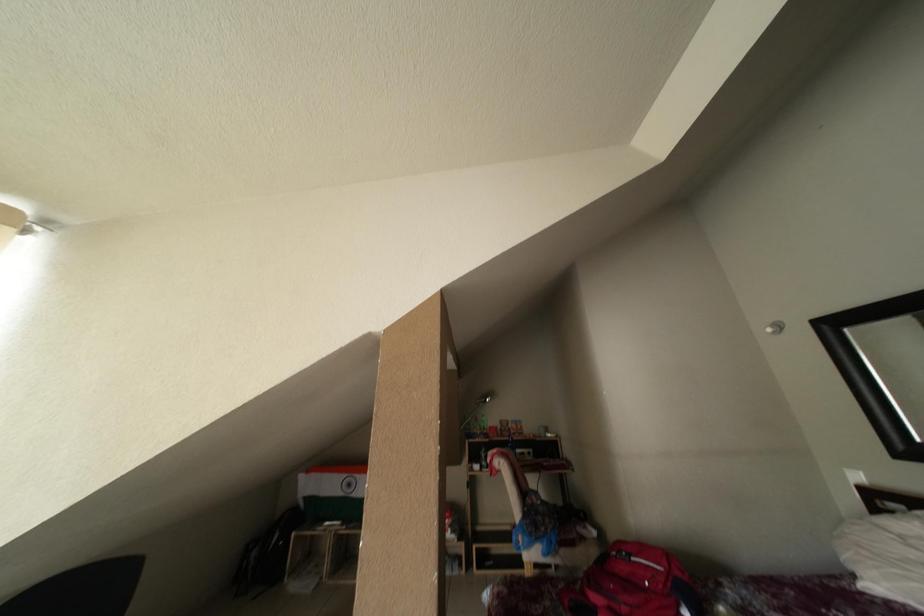
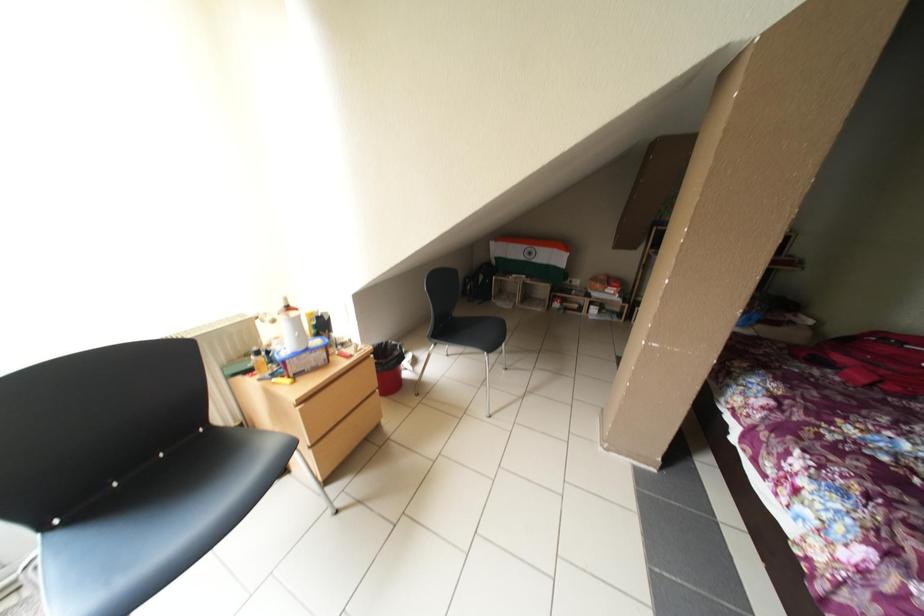
The images are taken continuously from a first-person perspective. In which direction is your viewpoint rotating?

The camera rotated toward left-down.